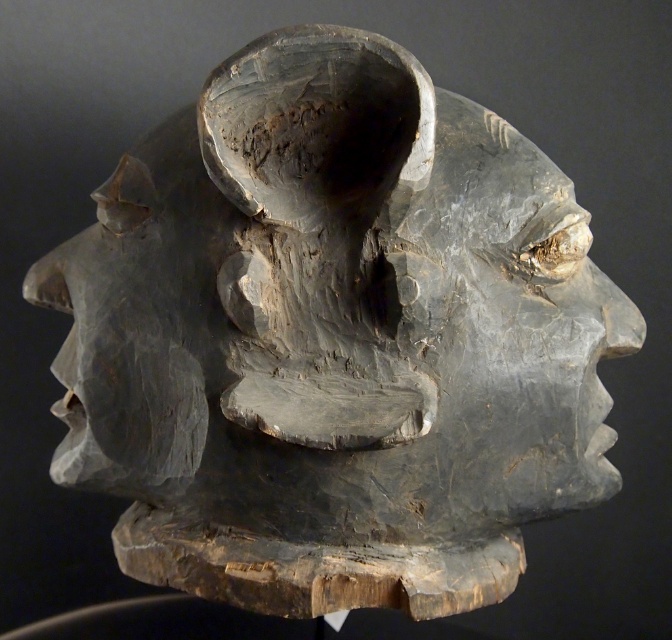
Is point (489, 150) farther from camera compared to point (185, 410)?

Yes, it is behind point (185, 410).

I want to click on gray wood carving at center, so click(x=513, y=323).